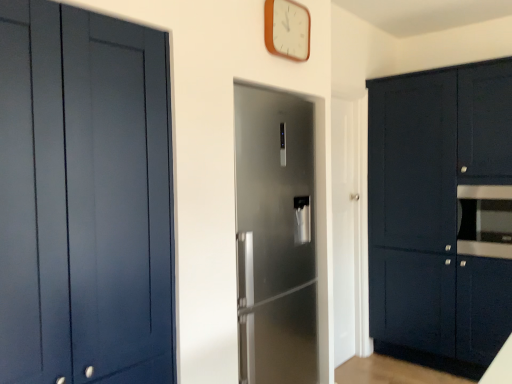
Question: From a real-world perspective, relative to white glossy door at center, which is counted as the 1th door, starting from the right, is matte blue cabinet at left, the first cabinetry in the left-to-right sequence, vertically above or below?

Choices:
 (A) above
 (B) below

Answer: (A)

Question: Visually, is matte blue cabinet at left, the 2th cabinetry viewed from the right, positioned to the left or to the right of white glossy door at center, marked as the 2th door in a left-to-right arrangement?

Choices:
 (A) left
 (B) right

Answer: (A)

Question: Based on their relative distances, which object is farther from the matte dark blue cabinets at right, the first cabinetry in the right-to-left sequence?

Choices:
 (A) white glossy door at center, placed as the 2th door when sorted from front to back
 (B) white wooden clock at upper center
 (C) satin silver refrigerator at center, which is the 1th door in front-to-back order
 (D) satin black oven at right
 (E) matte blue cabinet at left, which is the 2th cabinetry from back to front

Answer: (E)

Question: Estimate the real-world distances between objects in this image. Which object is closer to the matte dark blue cabinets at right, which ranks as the 1th cabinetry in back-to-front order?

Choices:
 (A) white glossy door at center, placed as the 2th door when sorted from front to back
 (B) satin silver refrigerator at center, which is the 1th door in front-to-back order
 (C) matte blue cabinet at left, the first cabinetry in the left-to-right sequence
 (D) white wooden clock at upper center
 (E) satin black oven at right

Answer: (E)